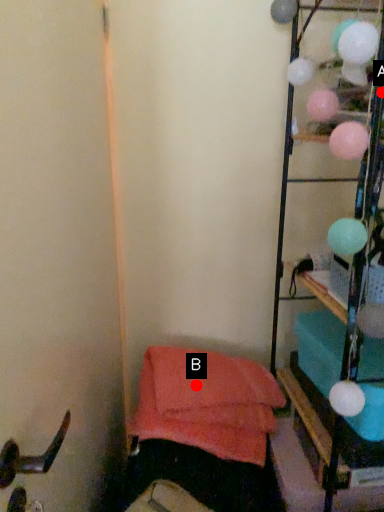
Question: Two points are circled on the image, labeled by A and B beside each circle. Which of the following is the farthest from the observer?

Choices:
 (A) A is further
 (B) B is further

Answer: (B)